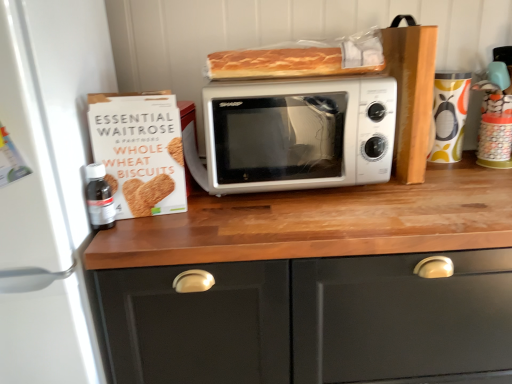
Locate an element on the screen. Image resolution: width=512 pixels, height=384 pixels. free space in front of matte ceramic mug at right, the second appliance in the left-to-right sequence is located at coordinates (468, 173).